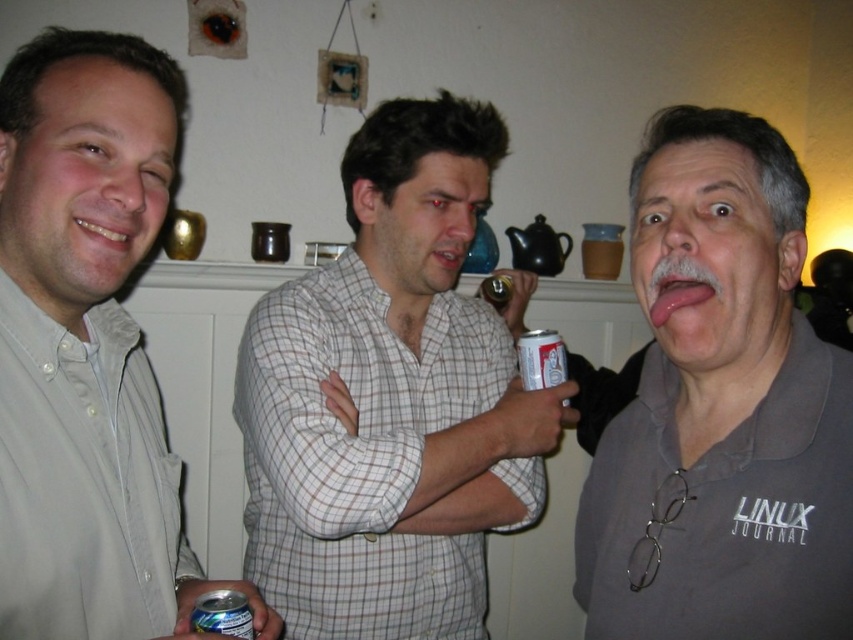
Does gray fabric shirt at center have a greater height compared to pink flesh at center?

Correct, gray fabric shirt at center is much taller as pink flesh at center.

Is gray fabric shirt at center to the right of pink flesh at center from the viewer's perspective?

Correct, you'll find gray fabric shirt at center to the right of pink flesh at center.

Between point (752, 136) and point (660, 284), which one is positioned behind?

The point (752, 136) is behind.

This screenshot has height=640, width=853. Find the location of `gray fabric shirt at center`. gray fabric shirt at center is located at coordinates (722, 412).

The image size is (853, 640). I want to click on white paper can at center, so click(541, 358).

Who is more forward, (560, 368) or (195, 625)?

Point (195, 625) is more forward.

At what (x,y) coordinates should I click in order to perform the action: click on white paper can at center. Please return your answer as a coordinate pair (x, y). This screenshot has height=640, width=853. Looking at the image, I should click on coord(541,358).

Between gray fabric shirt at center and white paper can at center, which one appears on the left side from the viewer's perspective?

white paper can at center is more to the left.

Can you confirm if gray fabric shirt at center is thinner than white paper can at center?

Incorrect, gray fabric shirt at center's width is not less than white paper can at center's.

Image resolution: width=853 pixels, height=640 pixels. Describe the element at coordinates (722, 412) in the screenshot. I see `gray fabric shirt at center` at that location.

Locate an element on the screen. This screenshot has height=640, width=853. gray fabric shirt at center is located at coordinates (722, 412).